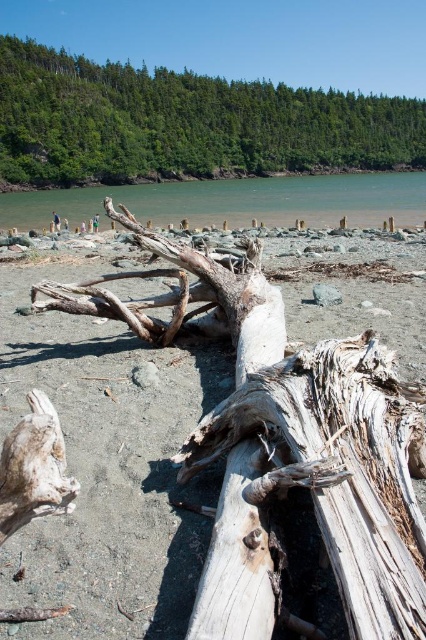
Question: Which is farther from the weathered wood driftwood at center?

Choices:
 (A) green leafy tree at upper center
 (B) gray weathered wood log at center

Answer: (A)

Question: Which object is farther from the camera taking this photo?

Choices:
 (A) weathered wood driftwood at center
 (B) green leafy tree at upper center
 (C) clear water at center

Answer: (B)

Question: Does gray weathered wood log at center have a lesser width compared to clear water at center?

Choices:
 (A) no
 (B) yes

Answer: (B)

Question: Where is weathered wood driftwood at center located in relation to clear water at center in the image?

Choices:
 (A) below
 (B) above

Answer: (A)

Question: Can you confirm if weathered wood driftwood at center is thinner than gray weathered wood log at center?

Choices:
 (A) no
 (B) yes

Answer: (A)

Question: Which point is farther to the camera?

Choices:
 (A) green leafy tree at upper center
 (B) weathered wood driftwood at center

Answer: (A)